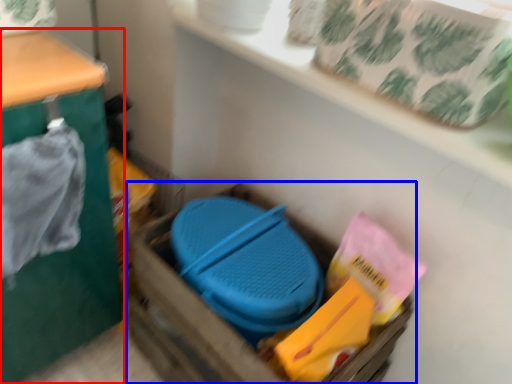
Question: Which point is further to the camera, furniture (highlighted by a red box) or storage box (highlighted by a blue box)?

Choices:
 (A) furniture
 (B) storage box

Answer: (B)